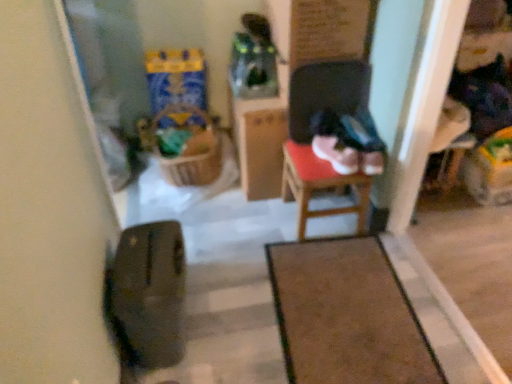
This screenshot has width=512, height=384. Identify the location of vacant space situated on the left part of wooden chair at center. (264, 223).